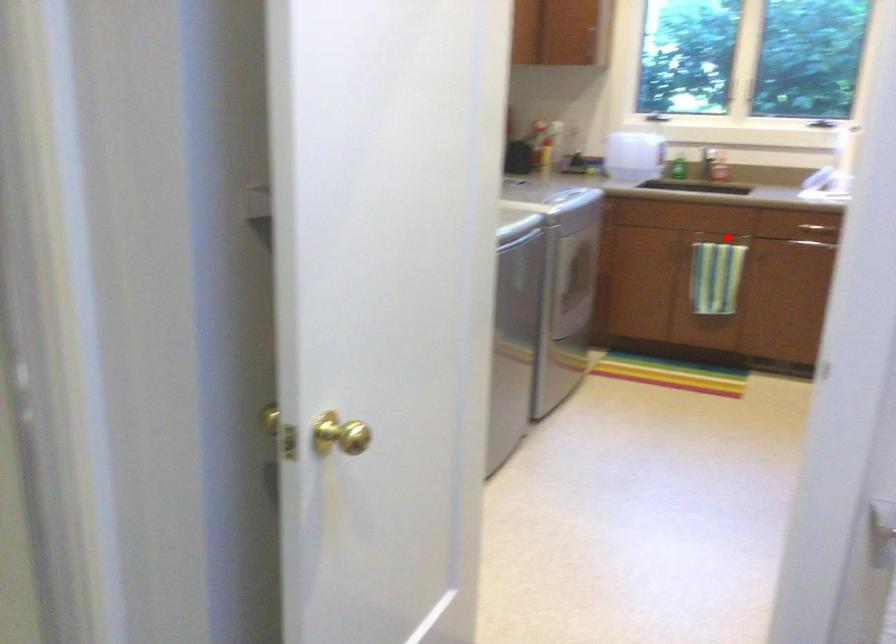
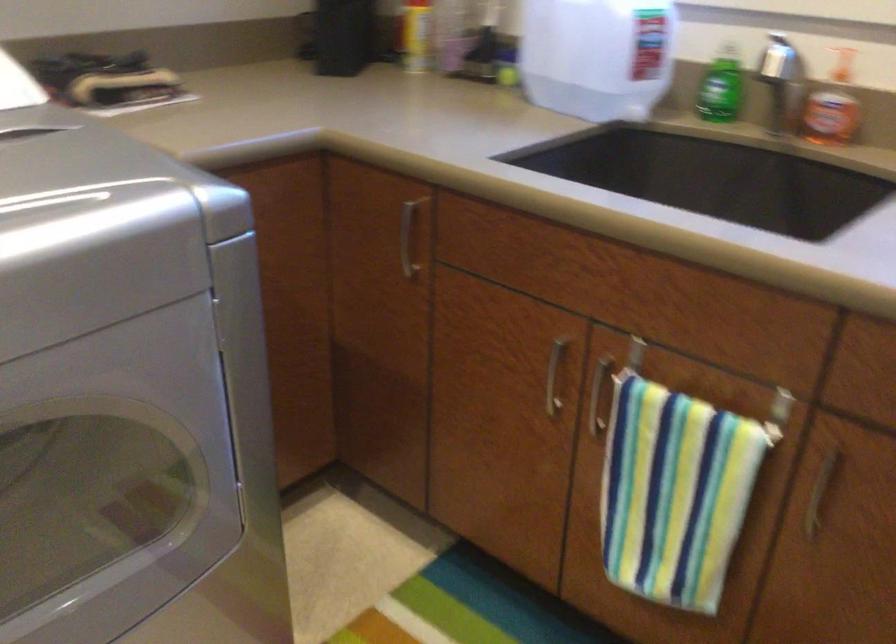
Where in the second image is the point corresponding to the highlighted location from the first image?

(727, 393)